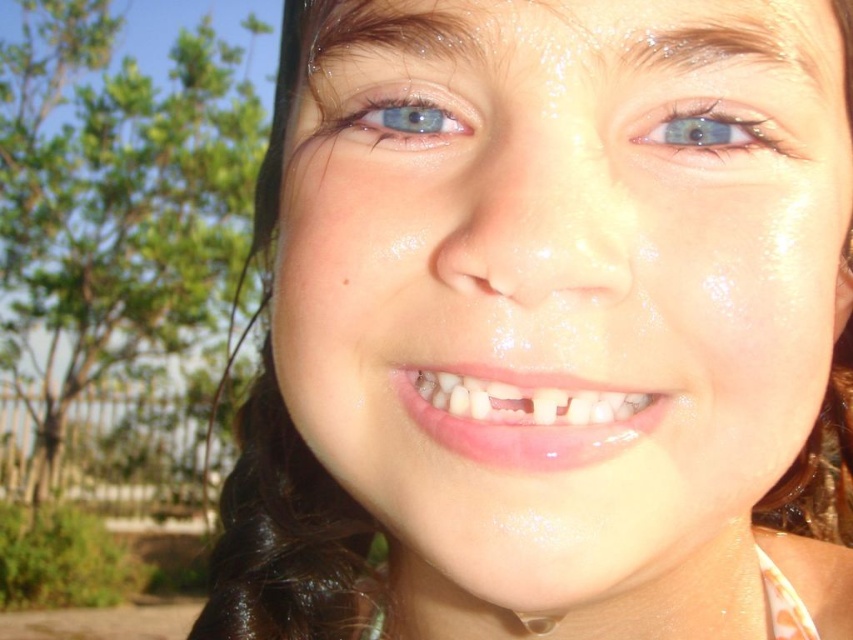
Question: Which of the following is the farthest from the observer?

Choices:
 (A) (415, 113)
 (B) (521, 362)
 (C) (718, 113)

Answer: (A)

Question: Is smooth skin face at center in front of blue glossy eye at upper right?

Choices:
 (A) yes
 (B) no

Answer: (A)

Question: Which point is closer to the camera?

Choices:
 (A) (368, 113)
 (B) (691, 166)

Answer: (B)

Question: Does smooth skin face at center appear under blue glossy eye at upper center?

Choices:
 (A) no
 (B) yes

Answer: (B)

Question: Does smooth skin face at center have a greater width compared to blue glossy eye at upper center?

Choices:
 (A) yes
 (B) no

Answer: (A)

Question: Which object is the closest to the smooth skin face at center?

Choices:
 (A) blue glossy eye at upper center
 (B) blue glossy eye at upper right

Answer: (B)